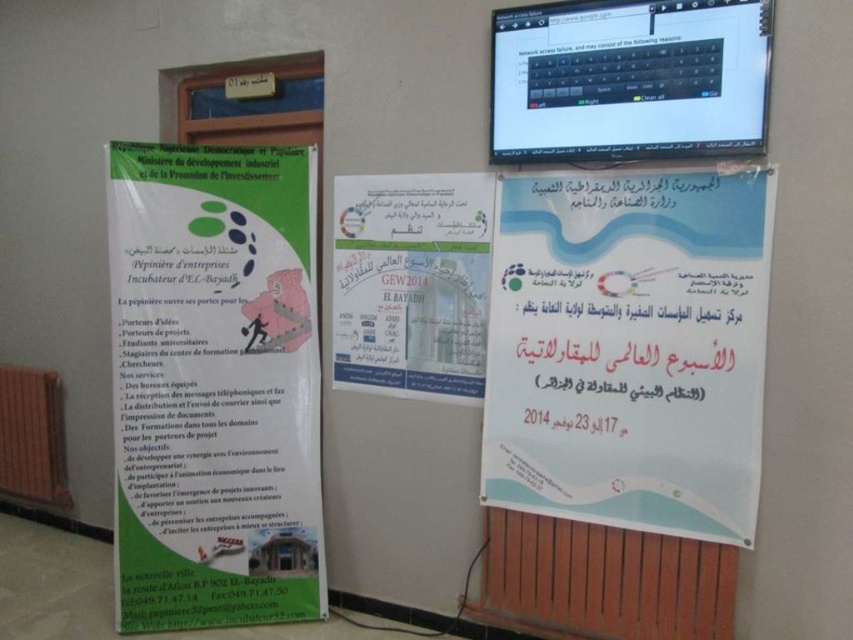
Does matte green poster at left lie in front of white paper at center?

No.

Consider the image. Can you confirm if matte green poster at left is positioned above white paper at center?

No.

Is point (212, 360) positioned behind point (357, 364)?

No.

At what (x,y) coordinates should I click in order to perform the action: click on matte green poster at left. Please return your answer as a coordinate pair (x, y). This screenshot has width=853, height=640. Looking at the image, I should click on (213, 385).

Who is lower down, white paper poster at center or white paper at center?

white paper poster at center

Is point (751, 260) closer to viewer compared to point (334, 284)?

Yes, point (751, 260) is closer to viewer.

Is point (495, 417) positioned after point (427, 358)?

No, it is not.

Identify the location of white paper poster at center. Image resolution: width=853 pixels, height=640 pixels. (630, 349).

Between point (154, 627) and point (616, 221), which one is positioned in front?

Point (616, 221)

Does matte green poster at left appear on the left side of white paper poster at center?

Correct, you'll find matte green poster at left to the left of white paper poster at center.

Is point (190, 225) farther from viewer compared to point (538, 352)?

That is True.

What are the coordinates of `matte green poster at left` in the screenshot? It's located at (213, 385).